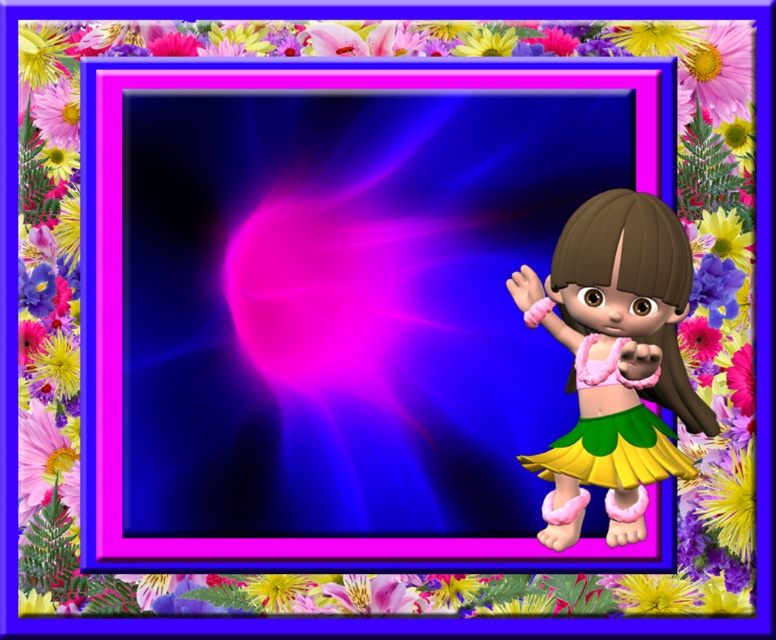
You are an animator working on a scene where the character needs to move her shiny pink fabric skirt at right to the left side. Based on its current position at point 0.537, 0.796, will moving it to the left require adjusting its vertical position as well?

The shiny pink fabric skirt at right is located at point (x=617, y=342). Moving it to the left would only require adjusting its horizontal position, as the vertical coordinate remains unchanged.